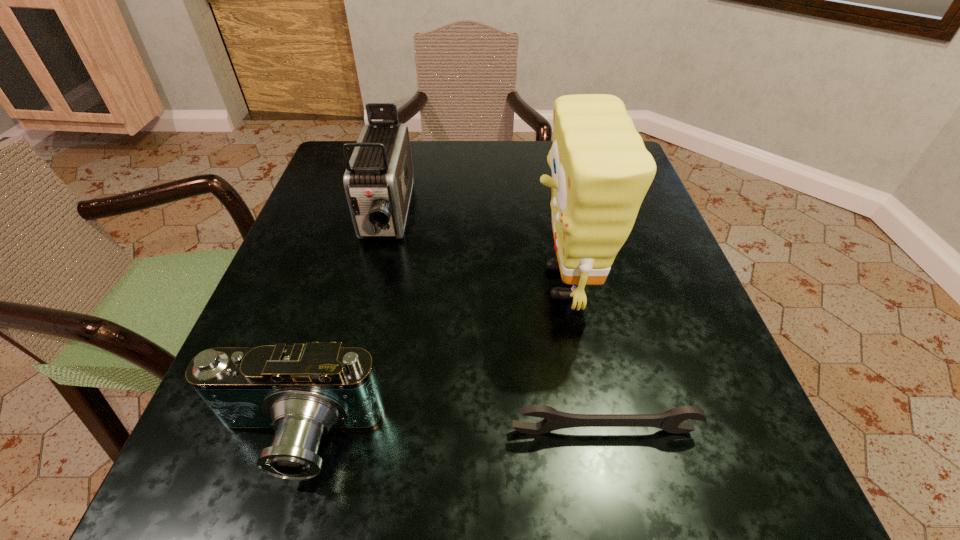
In order to click on empty space that is in between the sponge and the wrench in this screenshot , I will do `click(584, 357)`.

At what (x,y) coordinates should I click in order to perform the action: click on empty space between the taller camcorder and the shortest object. Please return your answer as a coordinate pair (x, y). The width and height of the screenshot is (960, 540). Looking at the image, I should click on (495, 323).

Identify the location of object that stands as the third closest to the wrench. (378, 181).

I want to click on object that ranks as the closest to the shortest object, so click(601, 171).

This screenshot has width=960, height=540. Find the location of `vacant space that satisfies the following two spatial constraints: 1. on the face of the sponge; 2. on the front-facing side of the shorter camcorder`. vacant space that satisfies the following two spatial constraints: 1. on the face of the sponge; 2. on the front-facing side of the shorter camcorder is located at coordinates click(593, 440).

In order to click on vacant space that satisfies the following two spatial constraints: 1. on the face of the sponge; 2. on the front-facing side of the third tallest object in this screenshot , I will do `click(593, 440)`.

The width and height of the screenshot is (960, 540). What are the coordinates of `free spot that satisfies the following two spatial constraints: 1. on the face of the sponge; 2. on the front-facing side of the nearer camcorder` in the screenshot? It's located at (593, 440).